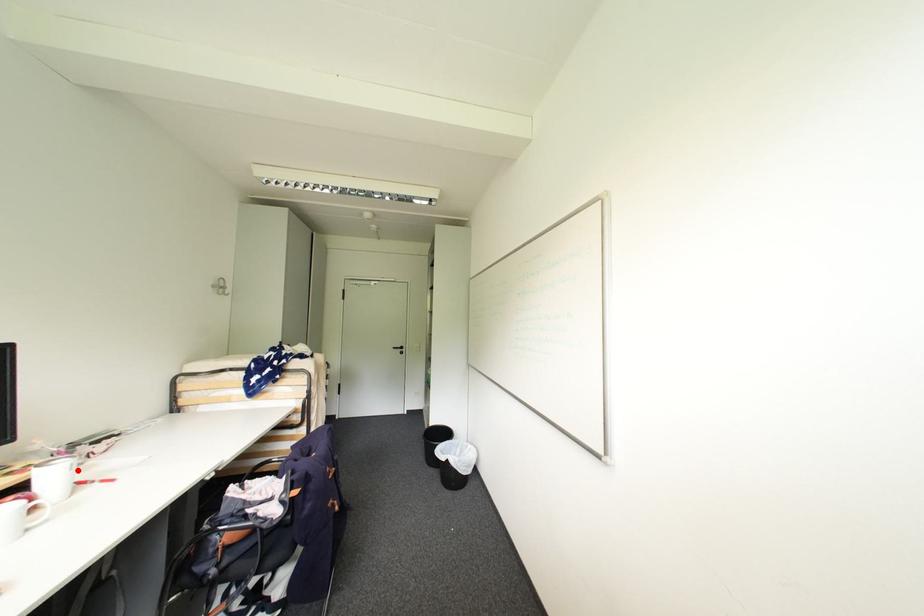
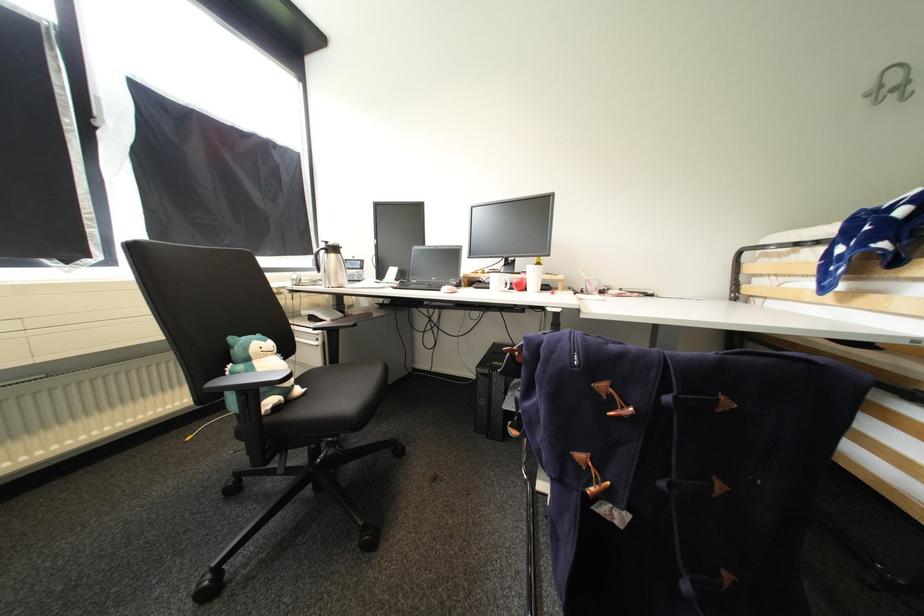
The point at the highlighted location is marked in the first image. Where is the corresponding point in the second image?

(541, 273)